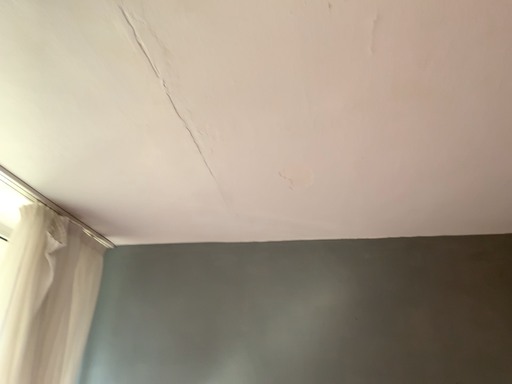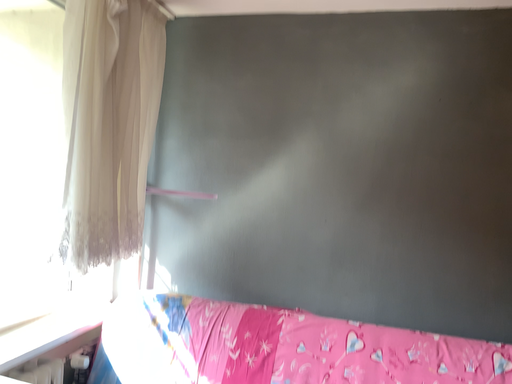
Question: How did the camera likely rotate when shooting the video?

Choices:
 (A) rotated downward
 (B) rotated upward

Answer: (A)